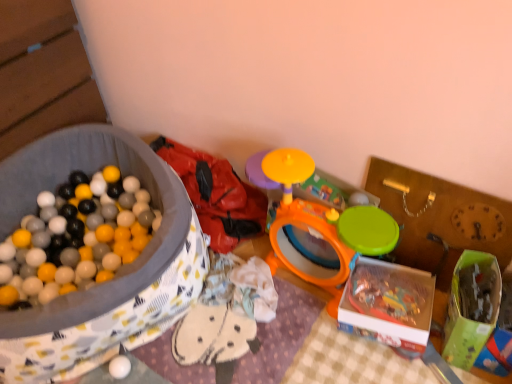
Question: From the image's perspective, relative to white matte ball at lower left, the 1th toy in the left-to-right sequence, is green plastic storage box at center-right, which is the third storage box from left to right, above or below?

Choices:
 (A) above
 (B) below

Answer: (A)

Question: Is point (499, 254) closer or farther from the camera than point (122, 364)?

Choices:
 (A) farther
 (B) closer

Answer: (B)

Question: Which of these objects is positioned closest to the green matte box at lower right?

Choices:
 (A) rubberized red jacket at upper left, which appears as the 2th toy when viewed from the left
 (B) translucent plastic box at lower right, the second storage box from the left
 (C) matte fabric ball pit at left, the third storage box in the right-to-left sequence
 (D) green plastic storage box at center-right, positioned as the first storage box in right-to-left order
 (E) orange plastic drum at center, the third toy from the left

Answer: (D)

Question: Estimate the real-world distances between objects in this image. Which object is farther from the green plastic storage box at center-right, positioned as the first storage box in right-to-left order?

Choices:
 (A) matte fabric ball pit at left, the third storage box in the right-to-left sequence
 (B) translucent plastic box at lower right, the second storage box from the left
 (C) green matte box at lower right
 (D) white matte ball at lower left, the 1th toy in the left-to-right sequence
 (E) orange plastic drum at center, marked as the 1th toy in a right-to-left arrangement

Answer: (D)